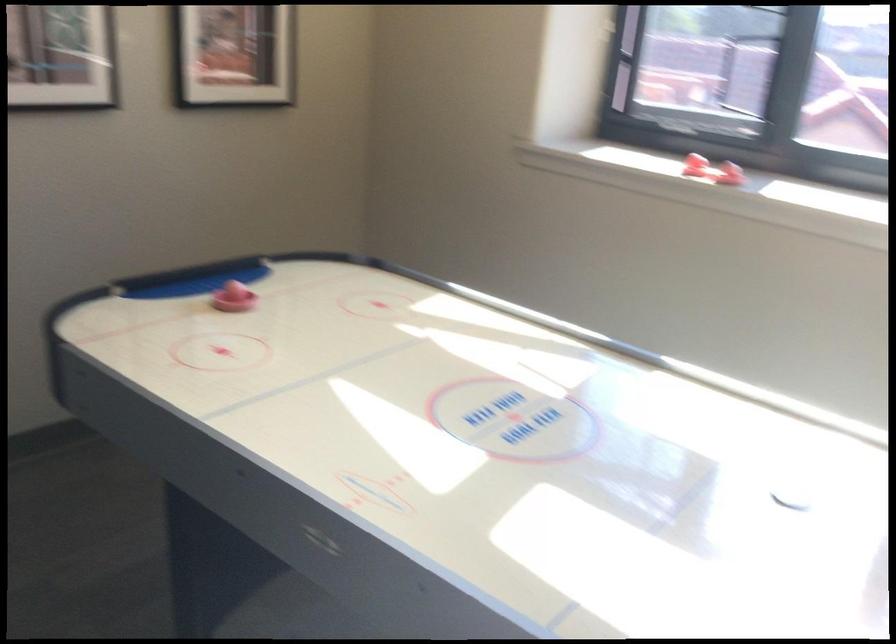
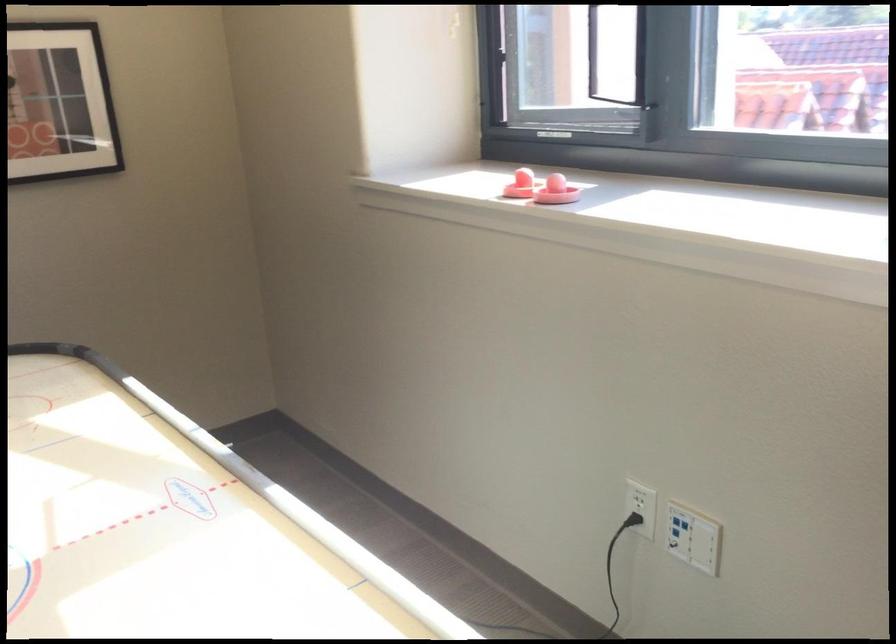
Find the pixel in the second image that matches point (719, 174) in the first image.

(556, 191)